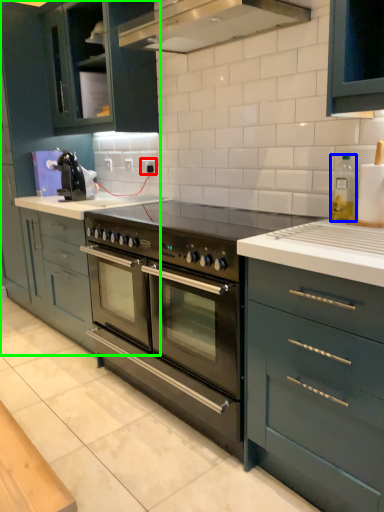
Question: Which object is positioned closest to electric outlet (highlighted by a red box)? Select from appliance (highlighted by a blue box) and cabinetry (highlighted by a green box).

Choices:
 (A) appliance
 (B) cabinetry

Answer: (B)